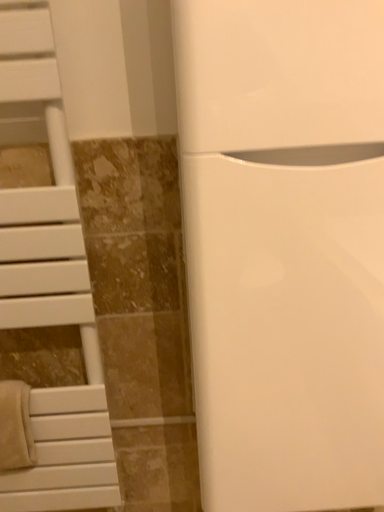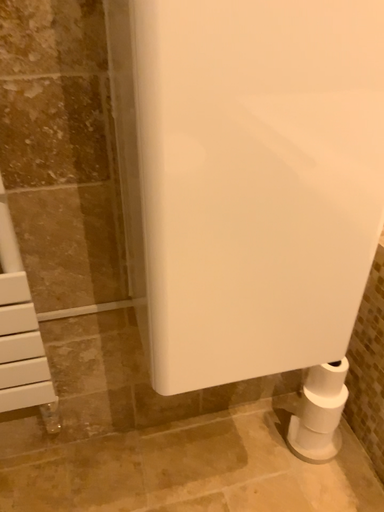
Question: How did the camera likely rotate when shooting the video?

Choices:
 (A) rotated downward
 (B) rotated upward

Answer: (A)